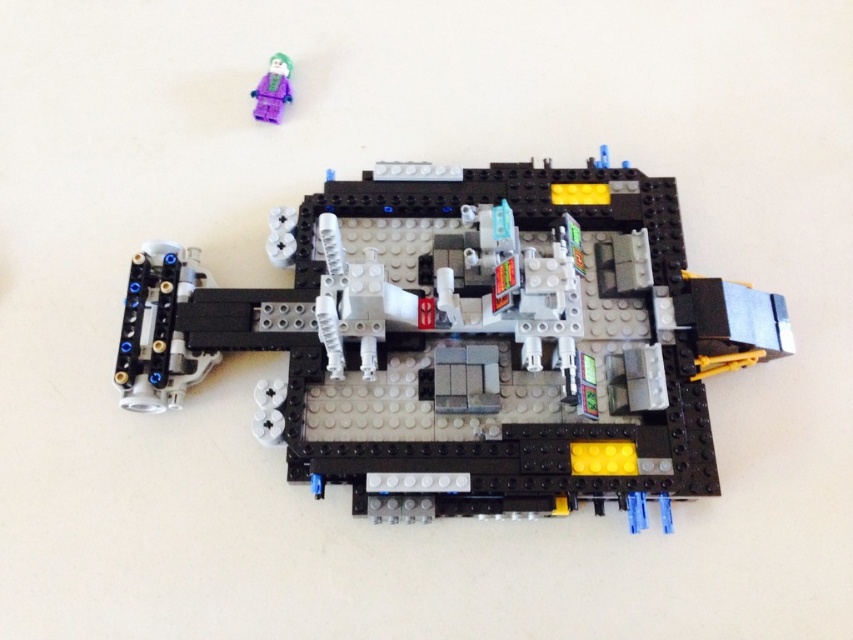
Which of these two, black plastic vehicle at center or purple matte minifigure at upper left, stands taller?

Standing taller between the two is black plastic vehicle at center.

Is black plastic vehicle at center closer to the viewer compared to purple matte minifigure at upper left?

Yes, black plastic vehicle at center is in front of purple matte minifigure at upper left.

The width and height of the screenshot is (853, 640). What do you see at coordinates (467, 339) in the screenshot?
I see `black plastic vehicle at center` at bounding box center [467, 339].

This screenshot has height=640, width=853. I want to click on black plastic vehicle at center, so click(x=467, y=339).